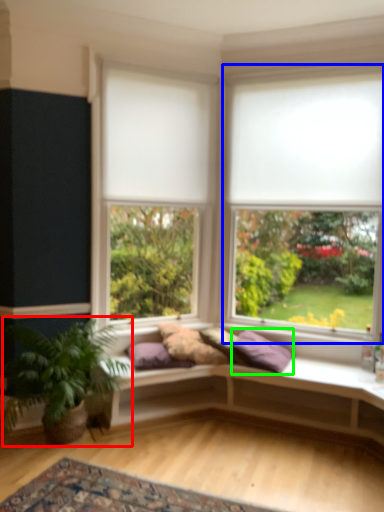
Question: Based on their relative distances, which object is farther from houseplant (highlighted by a red box)? Choose from window (highlighted by a blue box) and pillow (highlighted by a green box).

Choices:
 (A) window
 (B) pillow

Answer: (A)